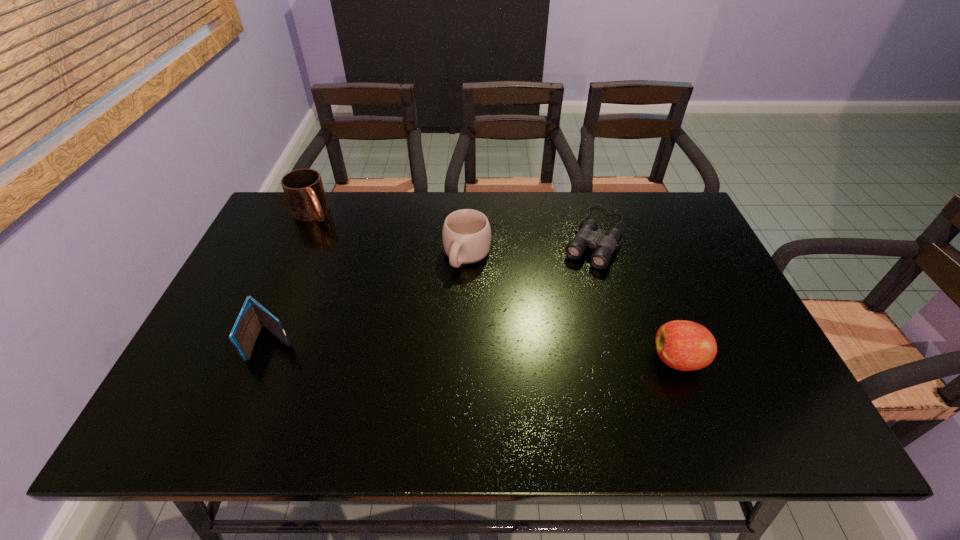
Identify the location of free space that is in between the apple and the shortest object. The height and width of the screenshot is (540, 960). (636, 298).

Where is `vacant space that's between the wallet and the farther mug`? vacant space that's between the wallet and the farther mug is located at coordinates (293, 278).

Where is `unoccupied position between the farther mug and the wallet`? This screenshot has width=960, height=540. unoccupied position between the farther mug and the wallet is located at coordinates (293, 278).

Locate an element on the screen. empty space that is in between the wallet and the shortest object is located at coordinates (434, 289).

Find the location of a particular element. Image resolution: width=960 pixels, height=540 pixels. free space between the binoculars and the apple is located at coordinates (636, 298).

The height and width of the screenshot is (540, 960). I want to click on vacant space that is in between the apple and the third object from left to right, so click(572, 307).

Where is `blank region between the binoculars and the apple`? The image size is (960, 540). blank region between the binoculars and the apple is located at coordinates (636, 298).

At what (x,y) coordinates should I click in order to perform the action: click on the fourth closest object to the apple. Please return your answer as a coordinate pair (x, y). Looking at the image, I should click on (303, 188).

Locate which object ranks third in proximity to the shortest object. Please provide its 2D coordinates. Your answer should be formatted as a tuple, i.e. [(x, y)], where the tuple contains the x and y coordinates of a point satisfying the conditions above.

[(253, 315)]

I want to click on free space that satisfies the following two spatial constraints: 1. on the exterior surface of the apple; 2. on the left side of the wallet, so click(266, 360).